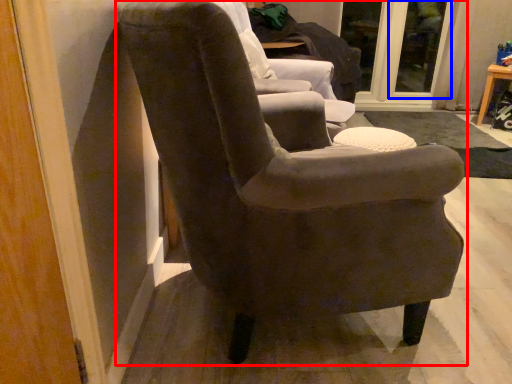
Question: Which object is further to the camera taking this photo, chair (highlighted by a red box) or glass door (highlighted by a blue box)?

Choices:
 (A) chair
 (B) glass door

Answer: (B)